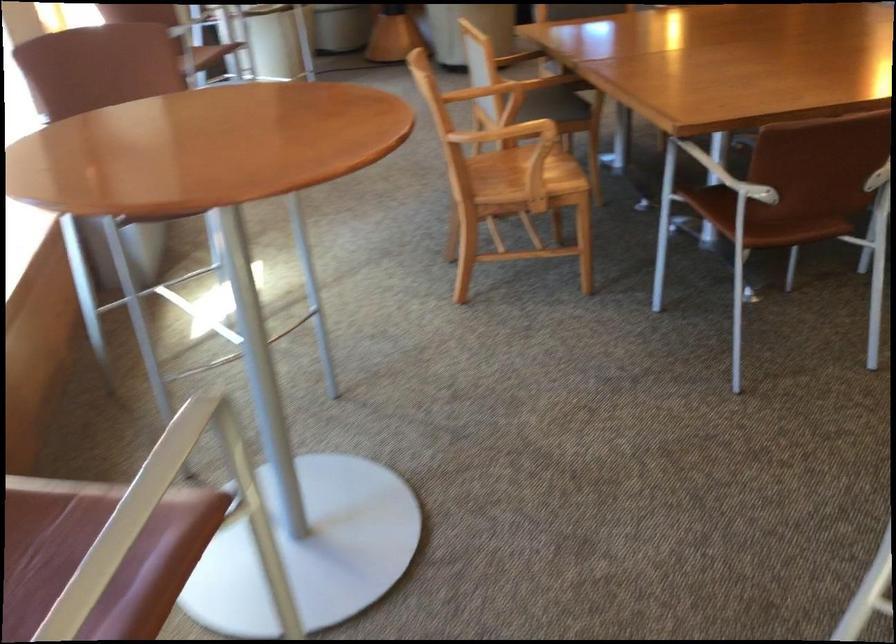
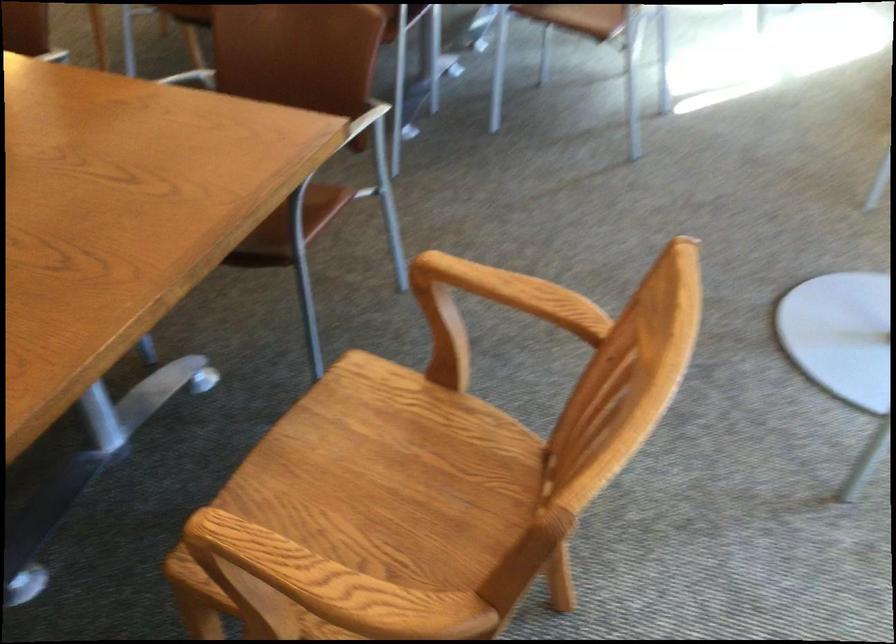
Question: I am providing you with two images of the same scene from different viewpoints. Which of the following objects are not visible in image2?

Choices:
 (A) white ceramic cup
 (B) wooden chair armrest
 (C) wooden chair sitting surface
 (D) brown chair sitting surface

Answer: (C)